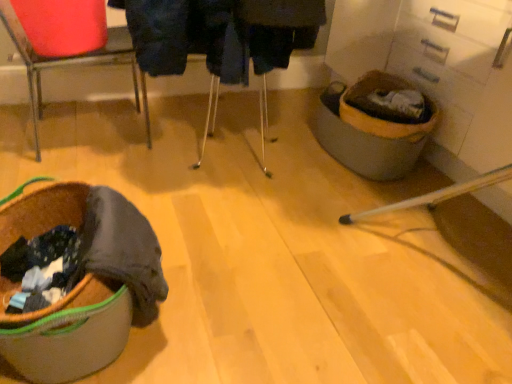
Identify the location of free location in front of metallic red chair at upper left. (65, 167).